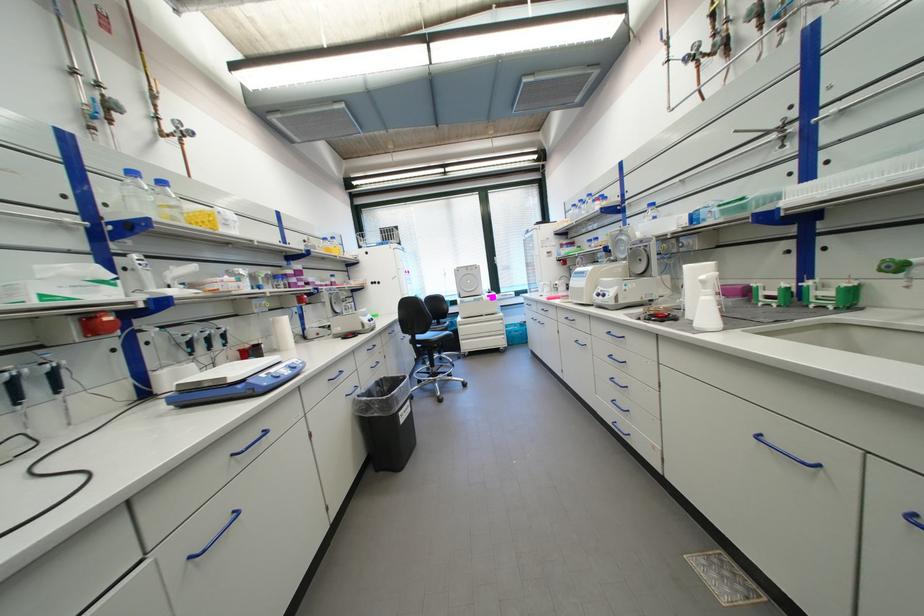
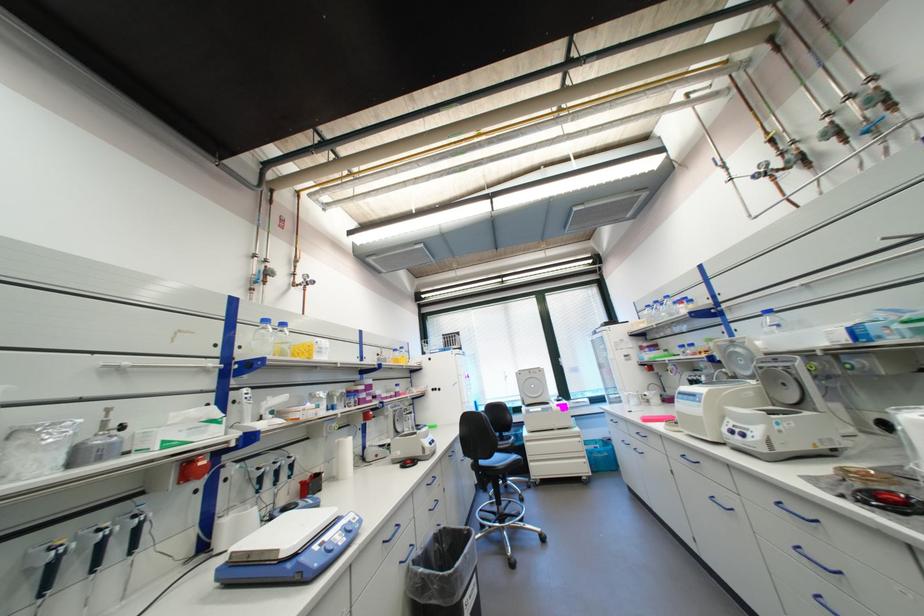
In the second image, find the point that corresponds to (x=271, y=376) in the first image.

(323, 548)